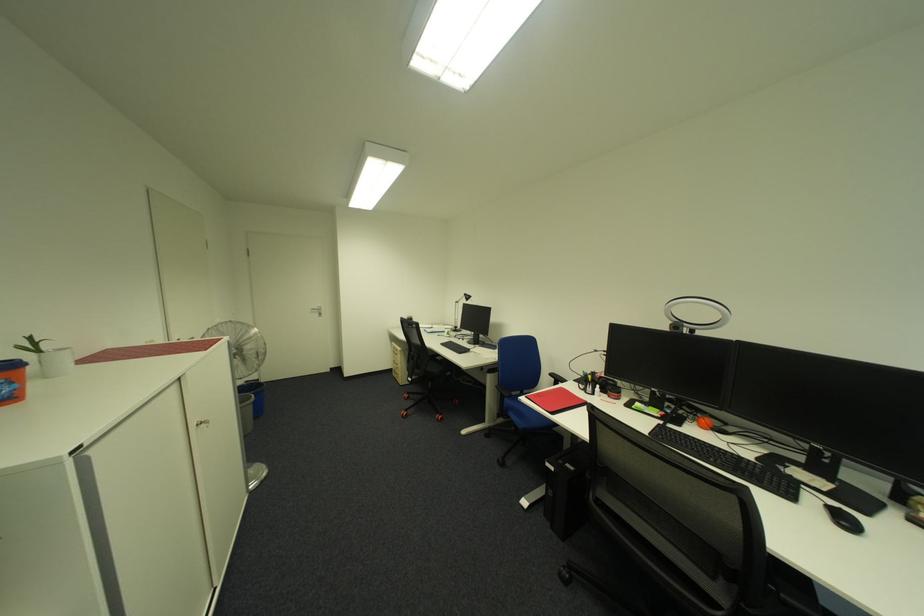
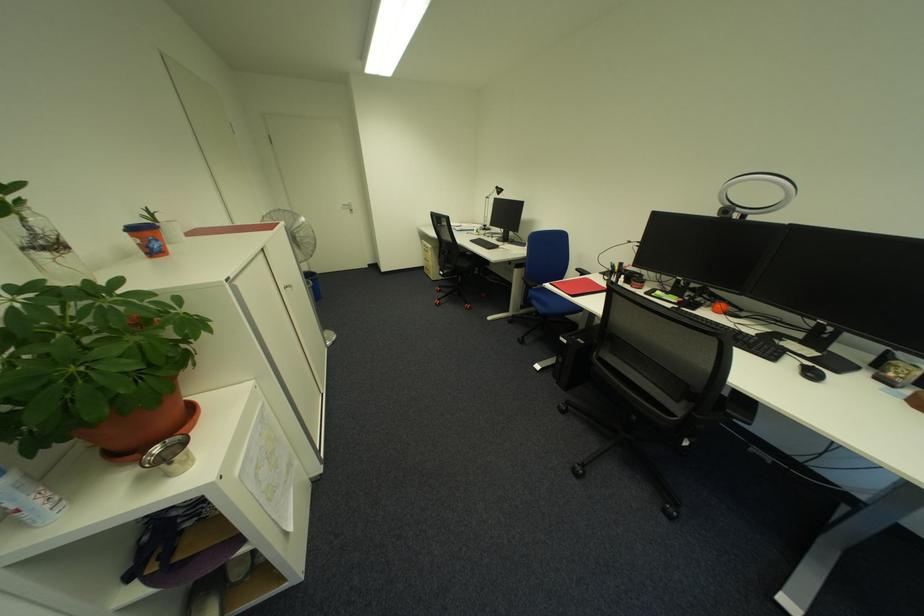
Locate, in the second image, the point that corresponds to point (446, 361) in the first image.

(477, 256)